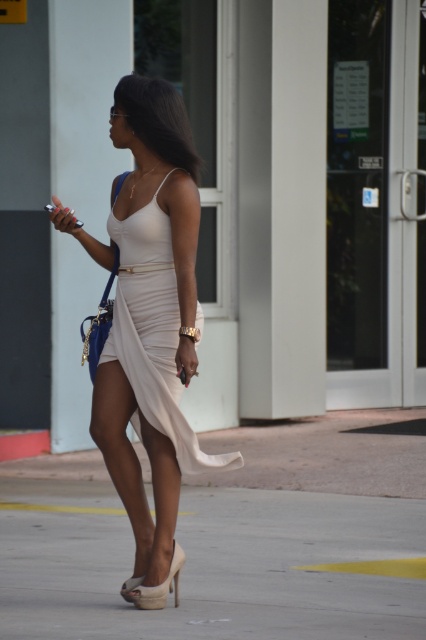
Based on the scene description, which object is taller between the beige concrete pavement at lower center and the white satin dress at center?

The white satin dress at center is taller than the beige concrete pavement at lower center.

You are standing at the camera position and want to throw a small ball to hit the point marked as point (132, 266). What is the minimum distance you need to throw the ball to reach that point?

The point (132, 266) is 6.86 meters away from the camera, so you need to throw the ball at least 6.86 meters to reach it.

You are standing behind the woman and want to determine which of the two points, point [221,557] or point [120,592], is closer to you. Based on the image, which point is nearer?

Point [221,557] is further to the viewer than point [120,592], so the closer point to you is point [120,592].